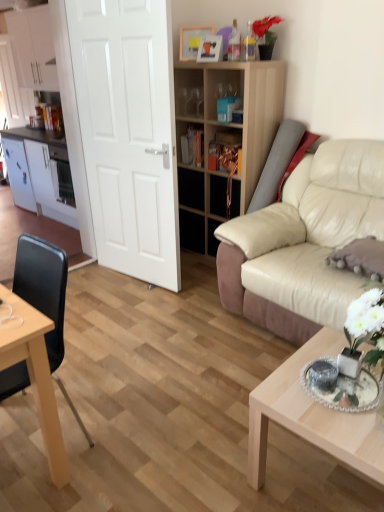
Identify the location of free location in front of white matte door at center. This screenshot has width=384, height=512. (140, 308).